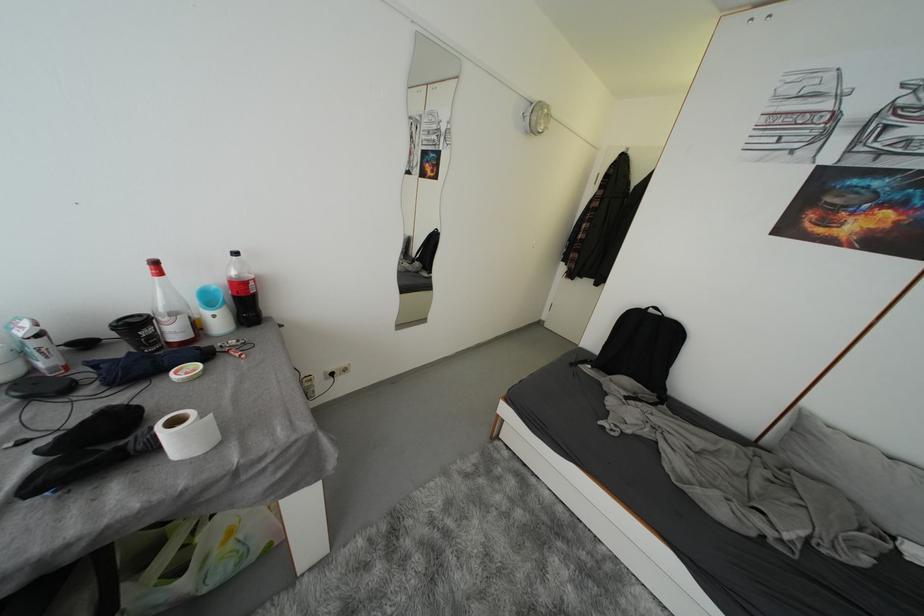
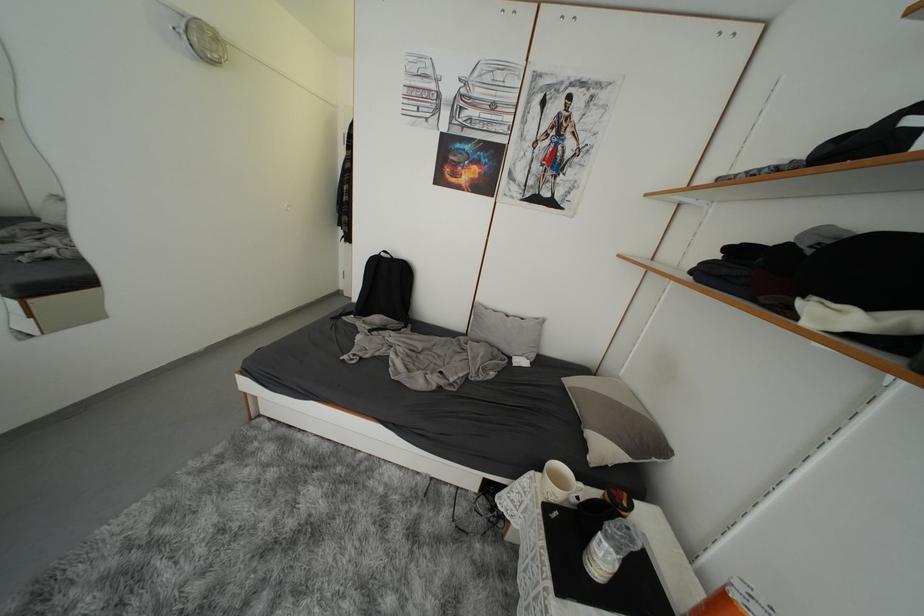
In the second image, find the point that corresponds to pixel 658 314 in the first image.

(390, 257)